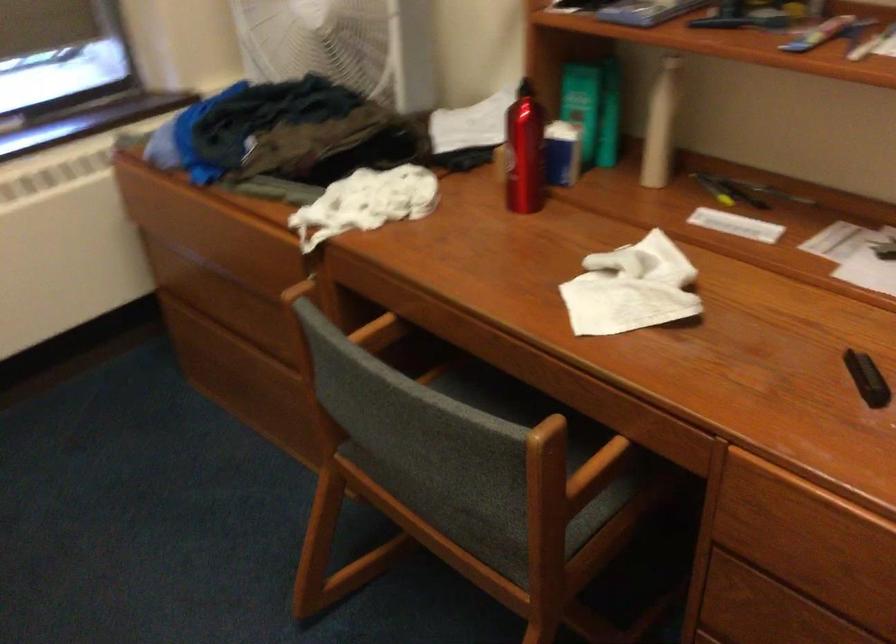
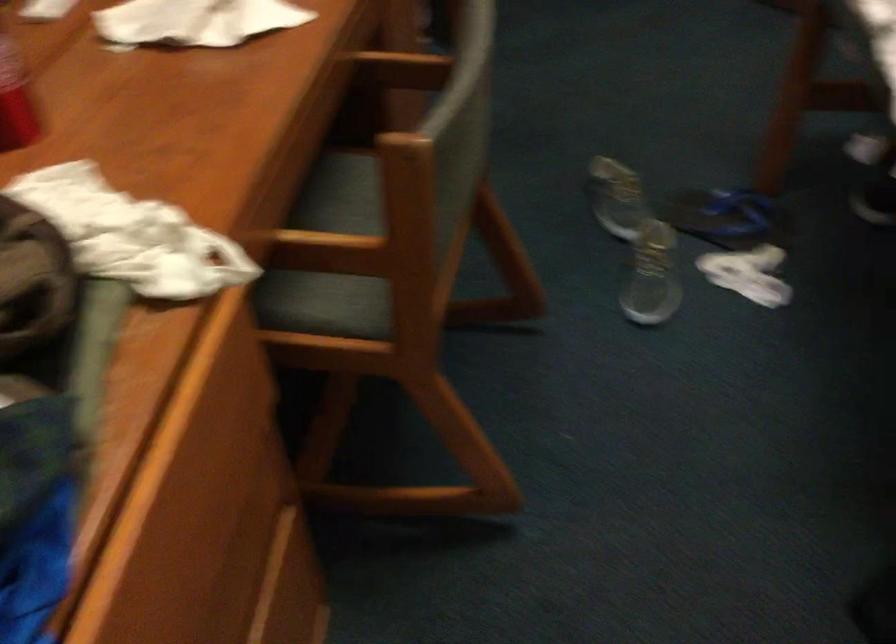
In the second image, find the point that corresponds to point (590, 477) in the first image.

(401, 69)